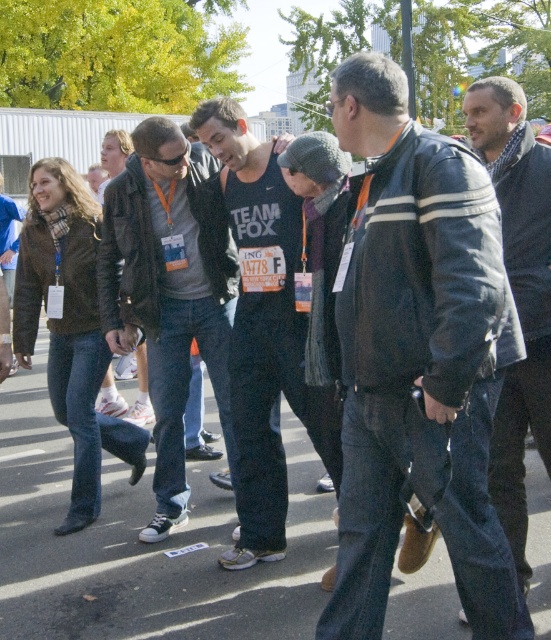
Does leather jacket at center have a larger size compared to matte black jacket at center?

Yes, leather jacket at center is bigger than matte black jacket at center.

Is the position of leather jacket at center less distant than that of matte black jacket at center?

That is True.

Does point (490, 528) come farther from viewer compared to point (215, 397)?

No, it is in front of (215, 397).

Where is `leather jacket at center`? The image size is (551, 640). leather jacket at center is located at coordinates (418, 358).

Is black matte tank top at center in front of matte brown jacket at left?

Yes.

Describe the element at coordinates (263, 332) in the screenshot. I see `black matte tank top at center` at that location.

The image size is (551, 640). Identify the location of black matte tank top at center. (263, 332).

What do you see at coordinates (71, 328) in the screenshot? The height and width of the screenshot is (640, 551). I see `matte brown jacket at left` at bounding box center [71, 328].

Is matte brown jacket at left behind dark gray jacket at center?

Yes, matte brown jacket at left is further from the viewer.

At what (x,y) coordinates should I click in order to perform the action: click on matte brown jacket at left. Please return your answer as a coordinate pair (x, y). The height and width of the screenshot is (640, 551). Looking at the image, I should click on (71, 328).